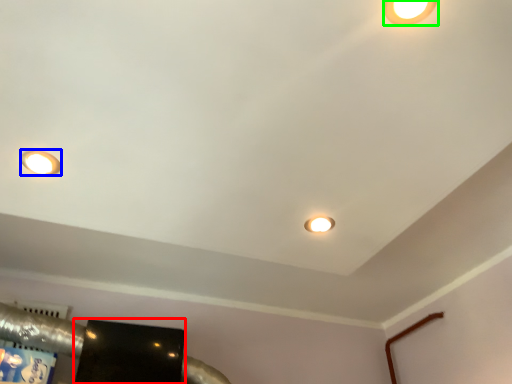
Question: Which is nearer to the wide (highlighted by a red box)? lamp (highlighted by a blue box) or lamp (highlighted by a green box).

Choices:
 (A) lamp
 (B) lamp

Answer: (A)